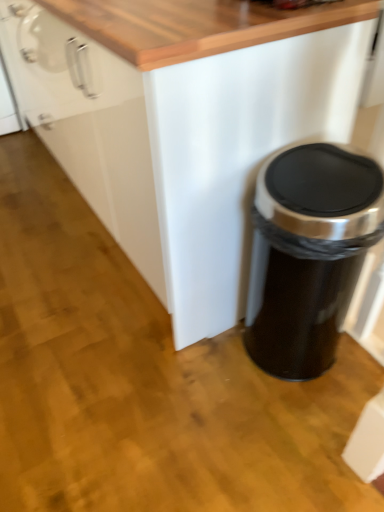
Where is `unoccupied area in front of black matte trash can at lower right`? This screenshot has height=512, width=384. unoccupied area in front of black matte trash can at lower right is located at coordinates (295, 424).